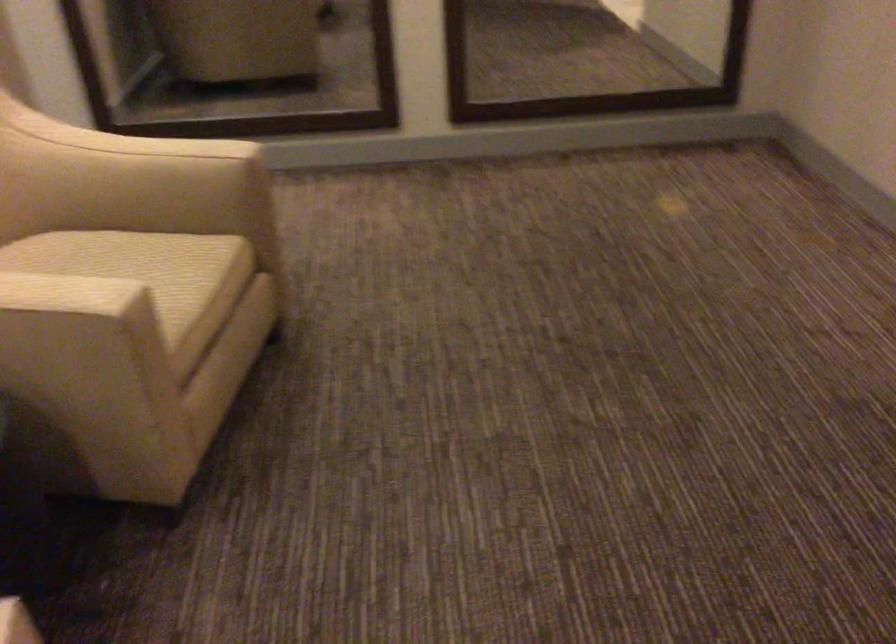
The image size is (896, 644). Describe the element at coordinates (143, 268) in the screenshot. I see `the chair sitting surface` at that location.